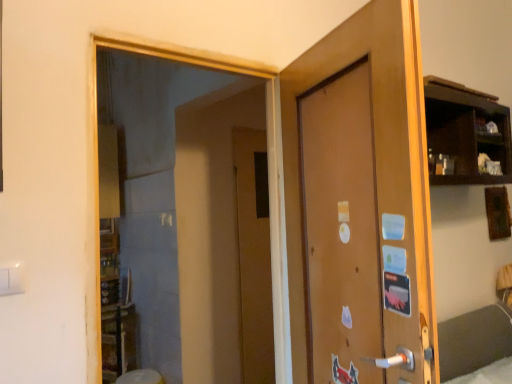
Question: Is brown matte door at center, acting as the first door starting from the back, placed right next to transparent glass mirror at upper left?

Choices:
 (A) no
 (B) yes

Answer: (A)

Question: Does brown matte door at center, acting as the first door starting from the back, have a larger size compared to transparent glass mirror at upper left?

Choices:
 (A) no
 (B) yes

Answer: (A)

Question: From a real-world perspective, is brown matte door at center, acting as the 2th door starting from the front, on top of transparent glass mirror at upper left?

Choices:
 (A) no
 (B) yes

Answer: (A)

Question: Is transparent glass mirror at upper left located within brown matte door at center, acting as the 2th door starting from the front?

Choices:
 (A) no
 (B) yes

Answer: (A)

Question: Is brown matte door at center, acting as the first door starting from the back, outside transparent glass mirror at upper left?

Choices:
 (A) yes
 (B) no

Answer: (A)

Question: Is brown matte door at center, acting as the first door starting from the back, positioned before transparent glass mirror at upper left?

Choices:
 (A) yes
 (B) no

Answer: (B)

Question: Is transparent glass mirror at upper left shorter than brown matte door at center, acting as the first door starting from the back?

Choices:
 (A) no
 (B) yes

Answer: (B)

Question: Does transparent glass mirror at upper left have a greater height compared to brown matte door at center, acting as the 2th door starting from the front?

Choices:
 (A) yes
 (B) no

Answer: (B)

Question: From a real-world perspective, is transparent glass mirror at upper left over brown matte door at center, acting as the 2th door starting from the front?

Choices:
 (A) yes
 (B) no

Answer: (A)

Question: Is transparent glass mirror at upper left touching brown matte door at center, acting as the first door starting from the back?

Choices:
 (A) no
 (B) yes

Answer: (A)

Question: Is transparent glass mirror at upper left behind brown matte door at center, acting as the first door starting from the back?

Choices:
 (A) yes
 (B) no

Answer: (B)

Question: Is transparent glass mirror at upper left not within brown matte door at center, acting as the first door starting from the back?

Choices:
 (A) yes
 (B) no

Answer: (A)

Question: Considering the relative sizes of brown matte door at center, acting as the 2th door starting from the front, and brown matte door at center, which is the 2th door in back-to-front order, in the image provided, is brown matte door at center, acting as the 2th door starting from the front, bigger than brown matte door at center, which is the 2th door in back-to-front order,?

Choices:
 (A) no
 (B) yes

Answer: (A)